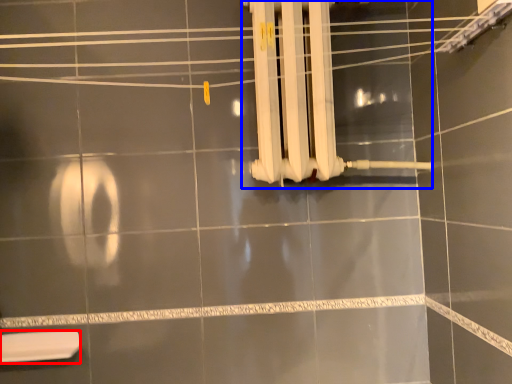
Question: Which object is further to the camera taking this photo, toilet (highlighted by a red box) or shower (highlighted by a blue box)?

Choices:
 (A) toilet
 (B) shower

Answer: (A)